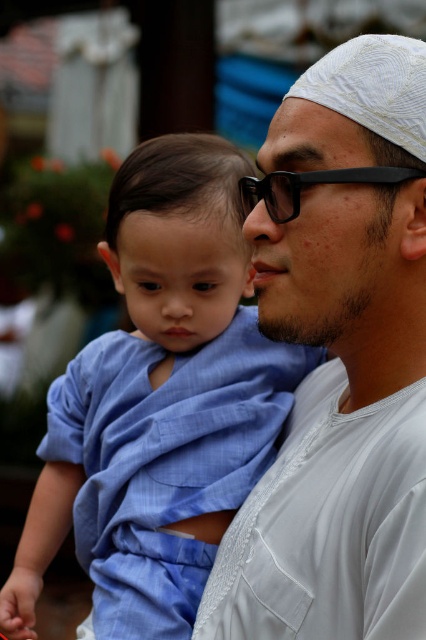
Based on the photo, you are a tailor who needs to determine which item takes up more space in your work area. Given the blue cotton cloth at center and the black matte glasses at center, which one requires more space?

The blue cotton cloth at center is larger in size than the black matte glasses at center, so it requires more space.

You are a photographer trying to capture a portrait of the two people in the image. The camera is set to focus on the white textured shirt at center. Where should you aim the focus point to ensure the shirt is in sharp focus?

You should aim the focus point at the coordinates point (x=339, y=360) to ensure the white textured shirt at center is in sharp focus.